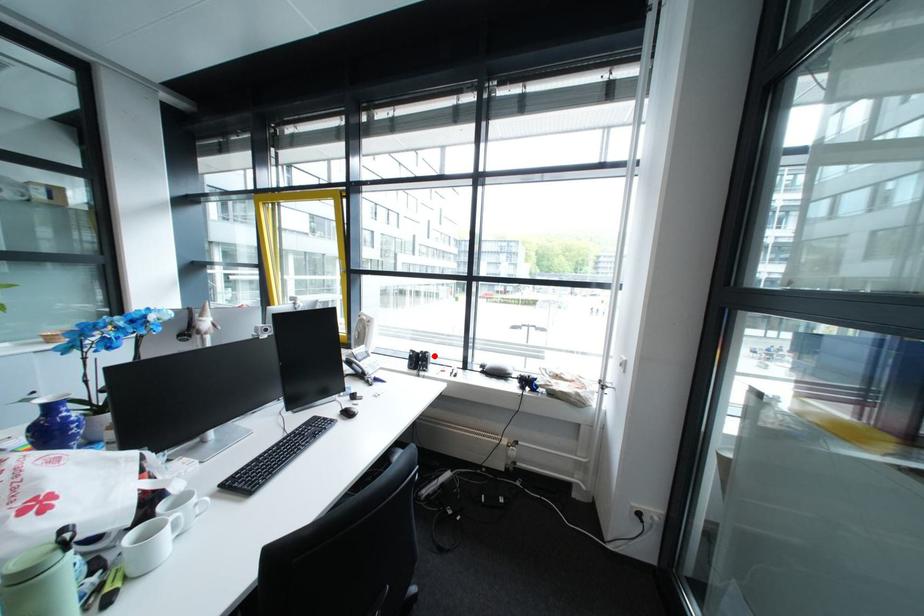
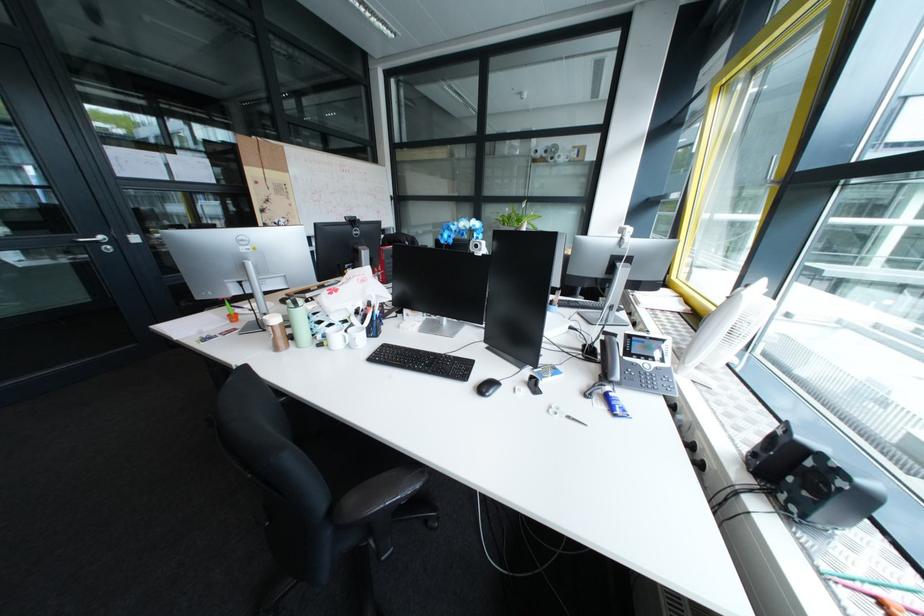
Locate, in the second image, the point that corresponds to the highlighted location in the first image.

(823, 464)